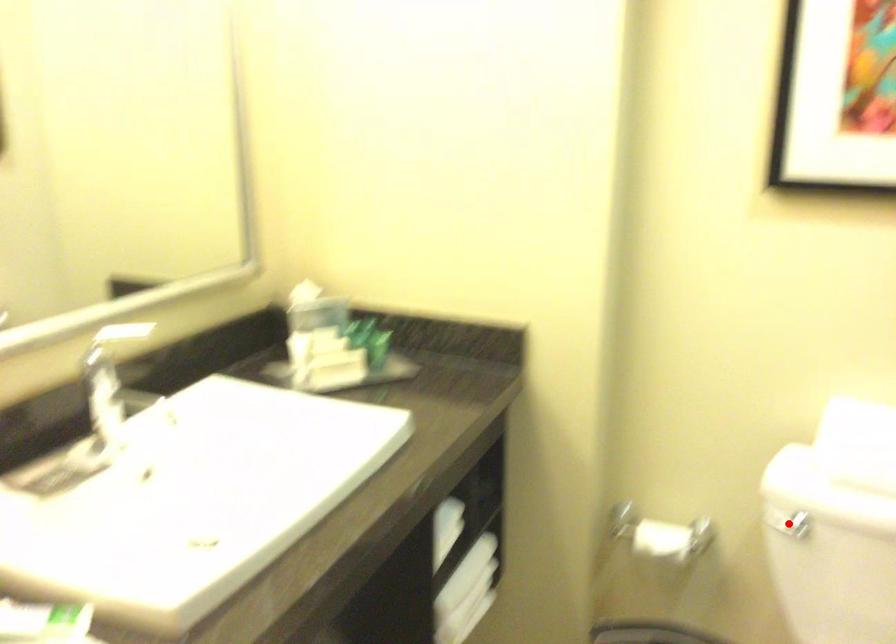
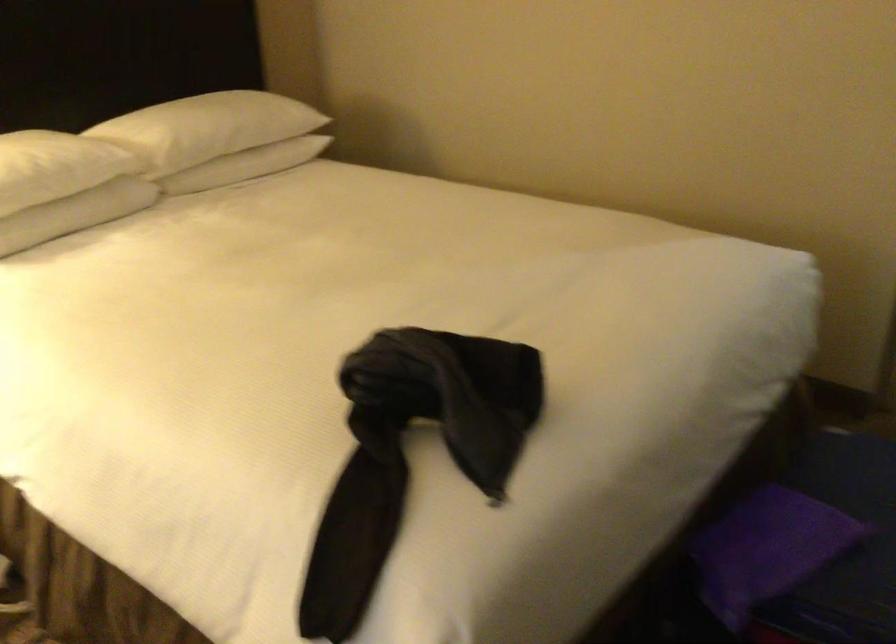
Question: I am providing you with two images of the same scene from different viewpoints. A red point is marked on the first image. At the location where the point appears in image 1, is it still visible in image 2?

Choices:
 (A) Yes
 (B) No

Answer: (B)